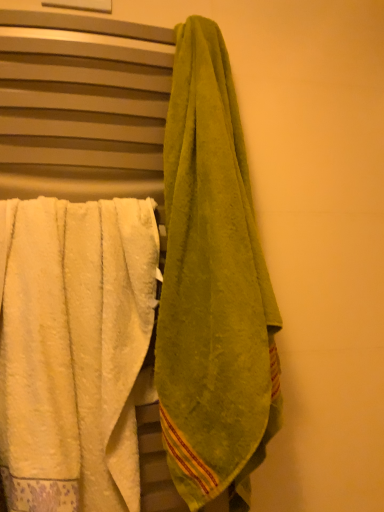
Question: From a real-world perspective, is green terry cloth towel at right, which appears as the 1th towel when viewed from the right, located beneath green cotton towel at right?

Choices:
 (A) yes
 (B) no

Answer: (B)

Question: From the image's perspective, does green terry cloth towel at right, which appears as the 1th towel when viewed from the right, appear higher than green cotton towel at right?

Choices:
 (A) no
 (B) yes

Answer: (B)

Question: Can you confirm if green terry cloth towel at right, positioned as the 2th towel in left-to-right order, is bigger than green cotton towel at right?

Choices:
 (A) yes
 (B) no

Answer: (B)

Question: Does green terry cloth towel at right, which appears as the 1th towel when viewed from the right, come behind green cotton towel at right?

Choices:
 (A) yes
 (B) no

Answer: (B)

Question: Is green terry cloth towel at right, positioned as the 2th towel in left-to-right order, facing towards green cotton towel at right?

Choices:
 (A) no
 (B) yes

Answer: (A)

Question: From the image's perspective, is white fluffy towel at left, the 2th towel viewed from the right, located above or below green terry cloth towel at right, positioned as the 2th towel in left-to-right order?

Choices:
 (A) above
 (B) below

Answer: (B)

Question: From a real-world perspective, is white fluffy towel at left, marked as the 1th towel in a left-to-right arrangement, above or below green terry cloth towel at right, which appears as the 1th towel when viewed from the right?

Choices:
 (A) below
 (B) above

Answer: (A)

Question: Considering the positions of white fluffy towel at left, the 2th towel viewed from the right, and green terry cloth towel at right, which appears as the 1th towel when viewed from the right, in the image, is white fluffy towel at left, the 2th towel viewed from the right, wider or thinner than green terry cloth towel at right, which appears as the 1th towel when viewed from the right,?

Choices:
 (A) wide
 (B) thin

Answer: (B)

Question: Considering their positions, is white fluffy towel at left, the 2th towel viewed from the right, located in front of or behind green terry cloth towel at right, which appears as the 1th towel when viewed from the right?

Choices:
 (A) front
 (B) behind

Answer: (B)

Question: Looking at their shapes, would you say green cotton towel at right is wider or thinner than white fluffy towel at left, the 2th towel viewed from the right?

Choices:
 (A) wide
 (B) thin

Answer: (B)

Question: Do you think green cotton towel at right is within white fluffy towel at left, the 2th towel viewed from the right, or outside of it?

Choices:
 (A) outside
 (B) inside

Answer: (B)

Question: From the image's perspective, is green cotton towel at right located above or below white fluffy towel at left, marked as the 1th towel in a left-to-right arrangement?

Choices:
 (A) above
 (B) below

Answer: (A)

Question: Visually, is green cotton towel at right positioned to the left or to the right of white fluffy towel at left, marked as the 1th towel in a left-to-right arrangement?

Choices:
 (A) left
 (B) right

Answer: (B)

Question: From a real-world perspective, is green terry cloth towel at right, which appears as the 1th towel when viewed from the right, positioned above or below white fluffy towel at left, the 2th towel viewed from the right?

Choices:
 (A) below
 (B) above

Answer: (B)

Question: From the image's perspective, is green terry cloth towel at right, which appears as the 1th towel when viewed from the right, located above or below white fluffy towel at left, marked as the 1th towel in a left-to-right arrangement?

Choices:
 (A) above
 (B) below

Answer: (A)